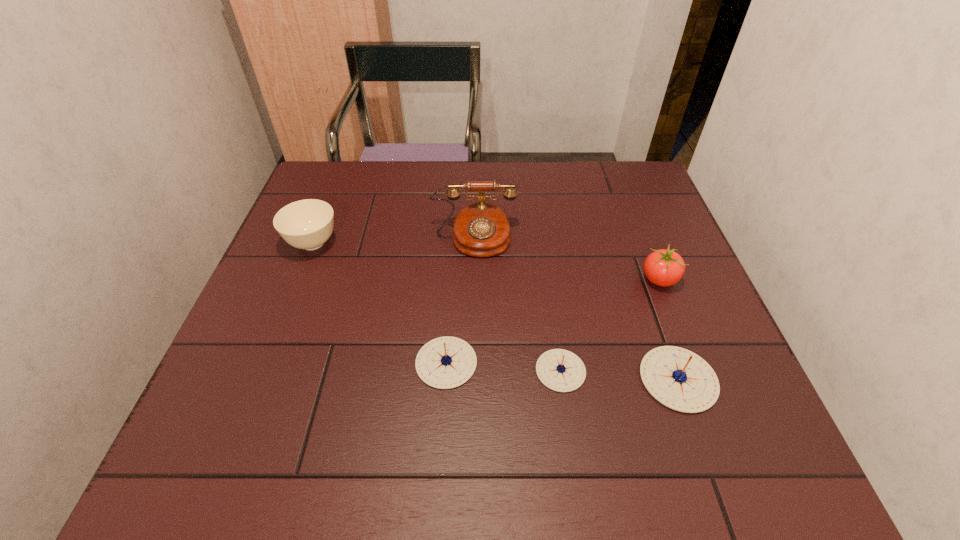
The image size is (960, 540). I want to click on free spot that satisfies the following two spatial constraints: 1. on the front side of the sugar bowl; 2. on the left side of the shortest object, so click(263, 370).

I want to click on vacant position in the image that satisfies the following two spatial constraints: 1. on the dial of the tallest object; 2. on the right side of the third farthest object, so click(473, 280).

The width and height of the screenshot is (960, 540). In order to click on vacant region that satisfies the following two spatial constraints: 1. on the back side of the tomato; 2. on the right side of the rightmost compass in this screenshot , I will do `click(643, 280)`.

Locate an element on the screen. The width and height of the screenshot is (960, 540). free location that satisfies the following two spatial constraints: 1. on the front side of the sugar bowl; 2. on the left side of the shortest compass is located at coordinates (263, 370).